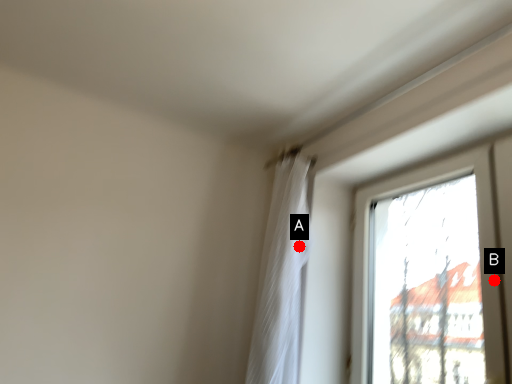
Question: Two points are circled on the image, labeled by A and B beside each circle. Which point is farther from the camera taking this photo?

Choices:
 (A) A is further
 (B) B is further

Answer: (A)